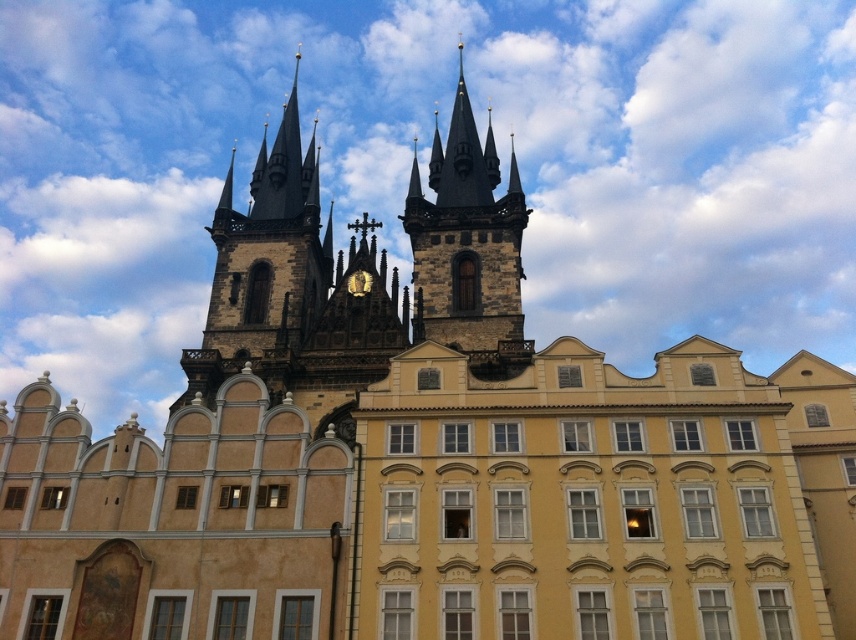
Which is in front, point (242, 225) or point (462, 346)?

Point (462, 346) is more forward.

Which of these two, dark gray stone tower at upper center or dark brown stone tower at center, stands shorter?

dark brown stone tower at center is shorter.

Does point (259, 300) come behind point (461, 81)?

That is False.

In order to click on dark gray stone tower at upper center in this screenshot , I will do `click(293, 289)`.